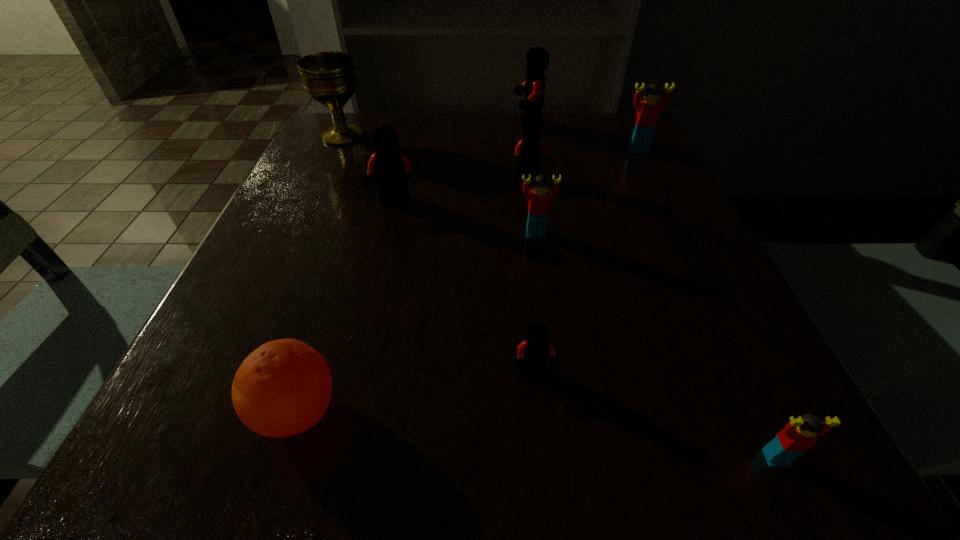
Identify the location of free space between the chalice and the second nearest red Lego. (440, 185).

Where is `free space between the second nearest Lego and the third nearest black Lego`? free space between the second nearest Lego and the third nearest black Lego is located at coordinates (532, 274).

At what (x,y) coordinates should I click in order to perform the action: click on blank region between the second farthest black Lego and the sixth farthest Lego. Please return your answer as a coordinate pair (x, y). Image resolution: width=960 pixels, height=540 pixels. Looking at the image, I should click on (532, 274).

The image size is (960, 540). I want to click on free spot between the third smallest black Lego and the nearest red Lego, so click(x=586, y=330).

This screenshot has height=540, width=960. In order to click on vacant space in between the biggest red Lego and the smallest black Lego in this screenshot , I will do `click(587, 261)`.

Where is `vacant region between the sixth nearest object and the orange orange`? vacant region between the sixth nearest object and the orange orange is located at coordinates (414, 294).

Find the location of a particular element. unoccupied position between the fourth nearest Lego and the second farthest black Lego is located at coordinates (463, 189).

At what (x,y) coordinates should I click in order to perform the action: click on unoccupied position between the orange and the nearest Lego. Please return your answer as a coordinate pair (x, y). Looking at the image, I should click on (537, 435).

Point out which object is positioned as the fourth nearest to the fourth nearest object. Please provide its 2D coordinates. Your answer should be formatted as a tuple, i.e. [(x, y)], where the tuple contains the x and y coordinates of a point satisfying the conditions above.

[(648, 110)]

You are a GUI agent. You are given a task and a screenshot of the screen. Output one action in this format:
    pyautogui.click(x=<x>, y=<y>)
    Task: Click on the object that stands as the third closest to the fifth farthest Lego
    
    Given the screenshot: What is the action you would take?
    pyautogui.click(x=534, y=352)